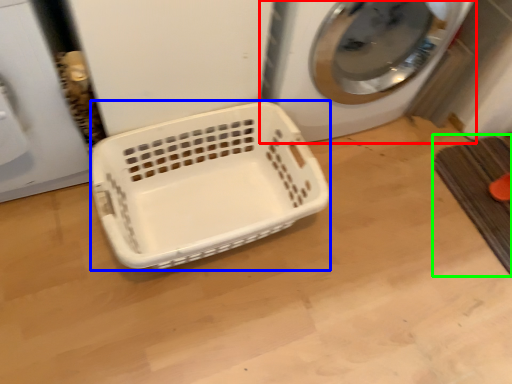
Question: Considering the real-world distances, which object is farthest from washing machine (highlighted by a red box)? basket (highlighted by a blue box) or bath mat (highlighted by a green box)?

Choices:
 (A) basket
 (B) bath mat

Answer: (B)